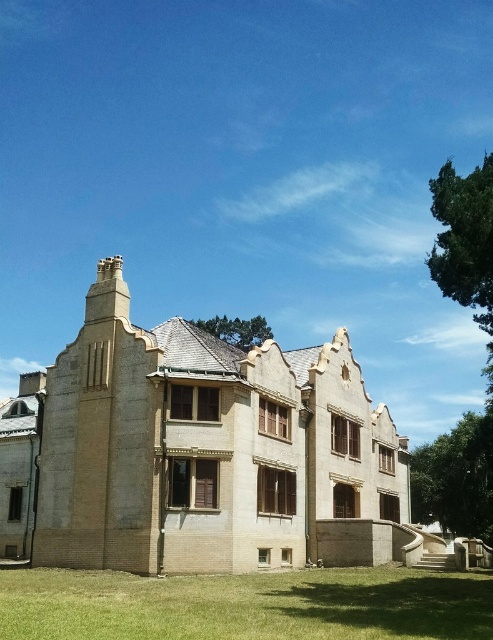
You are a landscape architect designing a garden for the beige brick mansion at center. Considering the size of the mansion and the green grass at lower center, which area would you prioritize for expansion to create a more balanced appearance?

The beige brick mansion at center has a larger size compared to green grass at lower center, so expanding the green grass at lower center would help create a more balanced appearance between the two elements.

You are standing in front of the beige brick mansion at center and want to walk to the green grass at lower center. Is the path clear between them?

The beige brick mansion at center is positioned over green grass at lower center, so the path is clear between them.